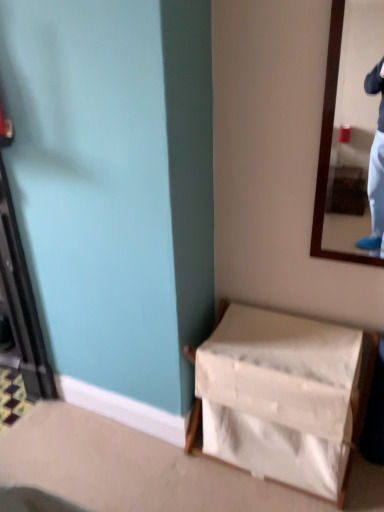
Question: From the image's perspective, is wooden-framed mirror at upper right beneath white fabric basket at lower right?

Choices:
 (A) no
 (B) yes

Answer: (A)

Question: Is wooden-framed mirror at upper right positioned with its back to white fabric basket at lower right?

Choices:
 (A) no
 (B) yes

Answer: (A)

Question: From a real-world perspective, is wooden-framed mirror at upper right positioned under white fabric basket at lower right based on gravity?

Choices:
 (A) yes
 (B) no

Answer: (B)

Question: Considering the relative sizes of wooden-framed mirror at upper right and white fabric basket at lower right in the image provided, is wooden-framed mirror at upper right smaller than white fabric basket at lower right?

Choices:
 (A) yes
 (B) no

Answer: (A)

Question: Does wooden-framed mirror at upper right have a greater width compared to white fabric basket at lower right?

Choices:
 (A) yes
 (B) no

Answer: (B)

Question: Can you see wooden-framed mirror at upper right touching white fabric basket at lower right?

Choices:
 (A) yes
 (B) no

Answer: (B)

Question: Does white fabric basket at lower right come behind wooden-framed mirror at upper right?

Choices:
 (A) yes
 (B) no

Answer: (A)

Question: Is white fabric basket at lower right to the right of wooden-framed mirror at upper right from the viewer's perspective?

Choices:
 (A) no
 (B) yes

Answer: (A)

Question: Is there a large distance between white fabric basket at lower right and wooden-framed mirror at upper right?

Choices:
 (A) no
 (B) yes

Answer: (A)

Question: Are white fabric basket at lower right and wooden-framed mirror at upper right beside each other?

Choices:
 (A) no
 (B) yes

Answer: (A)

Question: Is white fabric basket at lower right smaller than wooden-framed mirror at upper right?

Choices:
 (A) yes
 (B) no

Answer: (B)

Question: From the image's perspective, would you say white fabric basket at lower right is positioned over wooden-framed mirror at upper right?

Choices:
 (A) yes
 (B) no

Answer: (B)

Question: In terms of size, does wooden-framed mirror at upper right appear bigger or smaller than white fabric basket at lower right?

Choices:
 (A) big
 (B) small

Answer: (B)